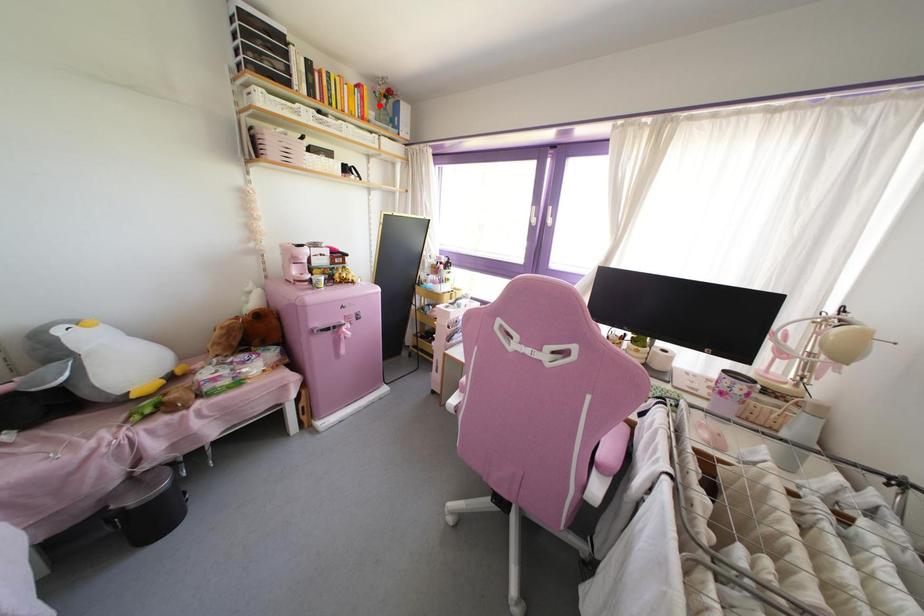
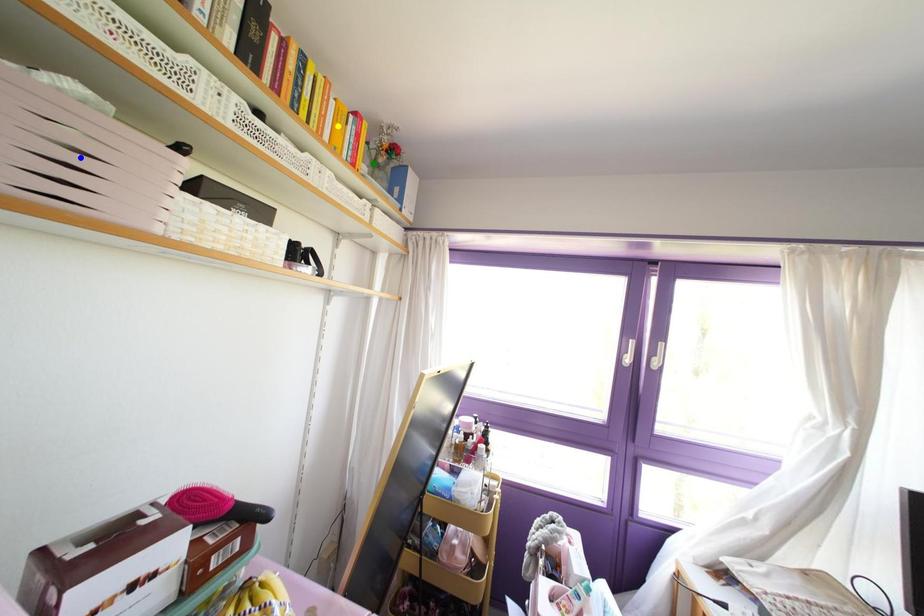
Question: I am providing you with two images of the same scene from different viewpoints. A red point is marked on the first image. You are given multiple points on the second image. Which mark in image 2 goes with the point in image 1?

Choices:
 (A) green point
 (B) blue point
 (C) yellow point

Answer: (A)